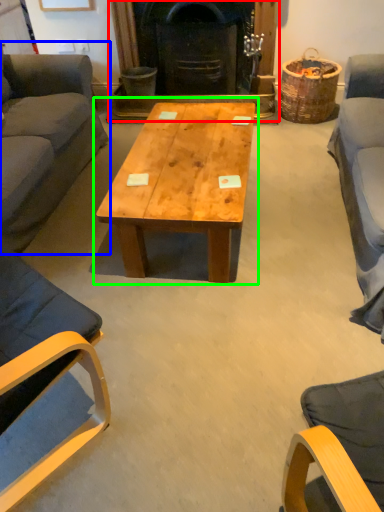
Question: Based on their relative distances, which object is nearer to fireplace (highlighted by a red box)? Choose from studio couch (highlighted by a blue box) and coffee table (highlighted by a green box).

Choices:
 (A) studio couch
 (B) coffee table

Answer: (A)